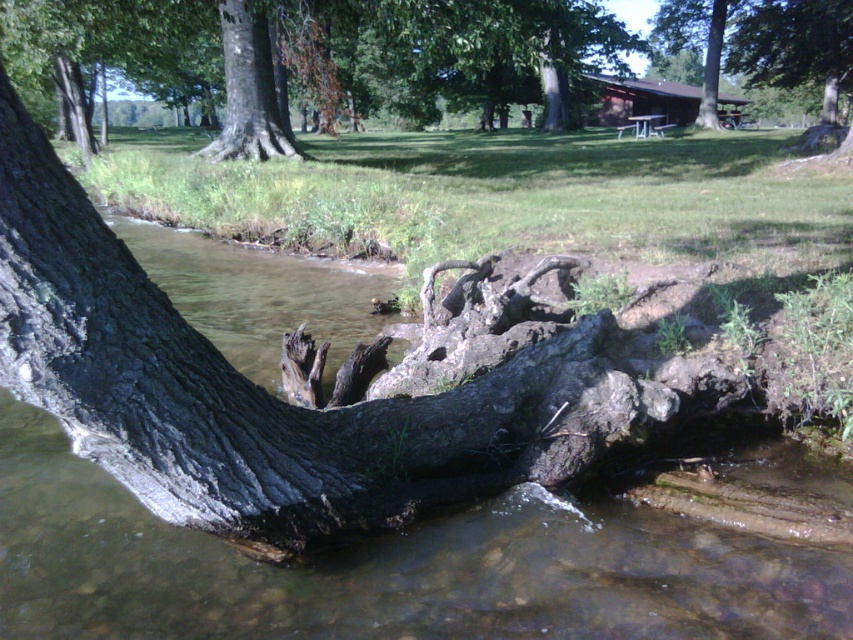
You are standing at the edge of the stream and want to reach the smooth bark tree trunk at upper center. Given that you can walk at a speed of 3 feet per second, how long will it take you to reach the tree trunk?

The distance between you and the smooth bark tree trunk at upper center is 54.70 feet. At a walking speed of 3 feet per second, it will take approximately 18.23 seconds to reach the tree trunk.

You are a hiker who wants to cross the stream without getting your boots wet. The dark gray bark tree trunk at left is on your side of the stream, and the smooth bark tree trunk at upper center is on the opposite side. Can you safely walk between them without getting wet?

The distance between the dark gray bark tree trunk at left and the smooth bark tree trunk at upper center is 22.63 feet. Since the stream is shallow and the tree trunks are on opposite sides, the gap between them is too wide to walk across without getting wet.

You are a hiker trying to cross the stream. You see the dark gray bark tree trunk at left and the smooth bark tree trunk at upper center. Which tree trunk is wider?

The dark gray bark tree trunk at left might be wider than smooth bark tree trunk at upper center.